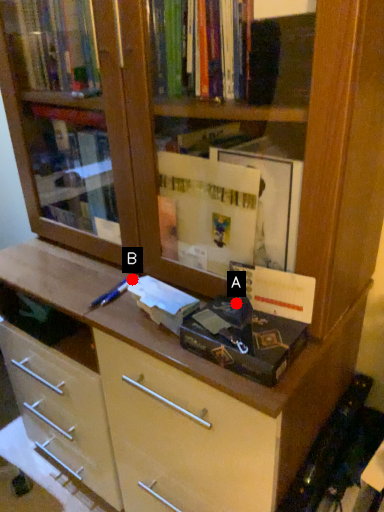
Question: Two points are circled on the image, labeled by A and B beside each circle. Which point is farther to the camera?

Choices:
 (A) A is further
 (B) B is further

Answer: (B)